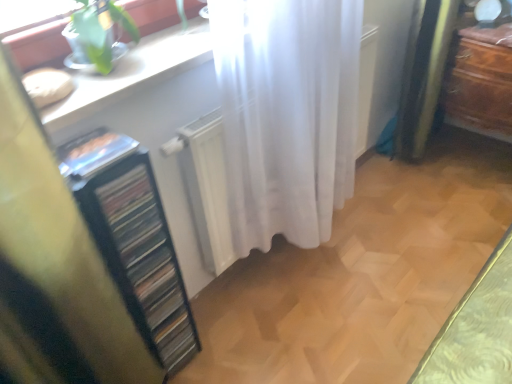
Question: Would you say white glossy counter top at upper left is a long distance from brown wooden dresser at right?

Choices:
 (A) no
 (B) yes

Answer: (B)

Question: Is white glossy counter top at upper left shorter than brown wooden dresser at right?

Choices:
 (A) yes
 (B) no

Answer: (A)

Question: Considering the relative positions of white glossy counter top at upper left and brown wooden dresser at right in the image provided, is white glossy counter top at upper left to the right of brown wooden dresser at right from the viewer's perspective?

Choices:
 (A) yes
 (B) no

Answer: (B)

Question: Is brown wooden dresser at right at the back of white glossy counter top at upper left?

Choices:
 (A) yes
 (B) no

Answer: (B)

Question: From the image's perspective, would you say white glossy counter top at upper left is shown under brown wooden dresser at right?

Choices:
 (A) no
 (B) yes

Answer: (B)

Question: Looking at the image, does white glossy counter top at upper left seem bigger or smaller compared to white sheer curtain at center?

Choices:
 (A) big
 (B) small

Answer: (B)

Question: Based on their positions, is white glossy counter top at upper left located to the left or right of white sheer curtain at center?

Choices:
 (A) right
 (B) left

Answer: (B)

Question: In terms of width, does white glossy counter top at upper left look wider or thinner when compared to white sheer curtain at center?

Choices:
 (A) wide
 (B) thin

Answer: (A)

Question: From the image's perspective, is white glossy counter top at upper left positioned above or below white sheer curtain at center?

Choices:
 (A) above
 (B) below

Answer: (A)

Question: In terms of height, does white sheer curtain at center look taller or shorter compared to white glossy counter top at upper left?

Choices:
 (A) tall
 (B) short

Answer: (A)

Question: Is white sheer curtain at center spatially inside white glossy counter top at upper left, or outside of it?

Choices:
 (A) inside
 (B) outside

Answer: (B)

Question: From a real-world perspective, is white sheer curtain at center positioned above or below white glossy counter top at upper left?

Choices:
 (A) below
 (B) above

Answer: (A)

Question: From the image's perspective, is white sheer curtain at center positioned above or below white glossy counter top at upper left?

Choices:
 (A) above
 (B) below

Answer: (B)

Question: In the image, is black plastic file cabinet at left on the left side or the right side of white glossy counter top at upper left?

Choices:
 (A) left
 (B) right

Answer: (A)

Question: Is black plastic file cabinet at left inside the boundaries of white glossy counter top at upper left, or outside?

Choices:
 (A) inside
 (B) outside

Answer: (B)